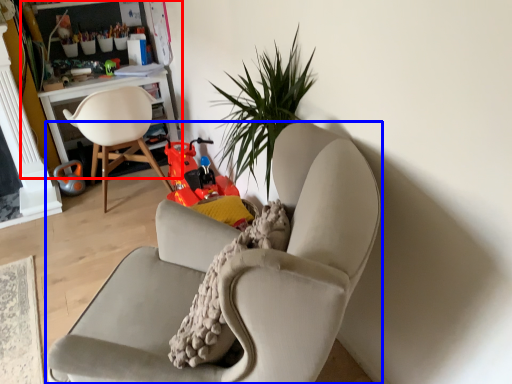
Question: Which point is further to the camera, bookshelf (highlighted by a red box) or chair (highlighted by a blue box)?

Choices:
 (A) bookshelf
 (B) chair

Answer: (A)